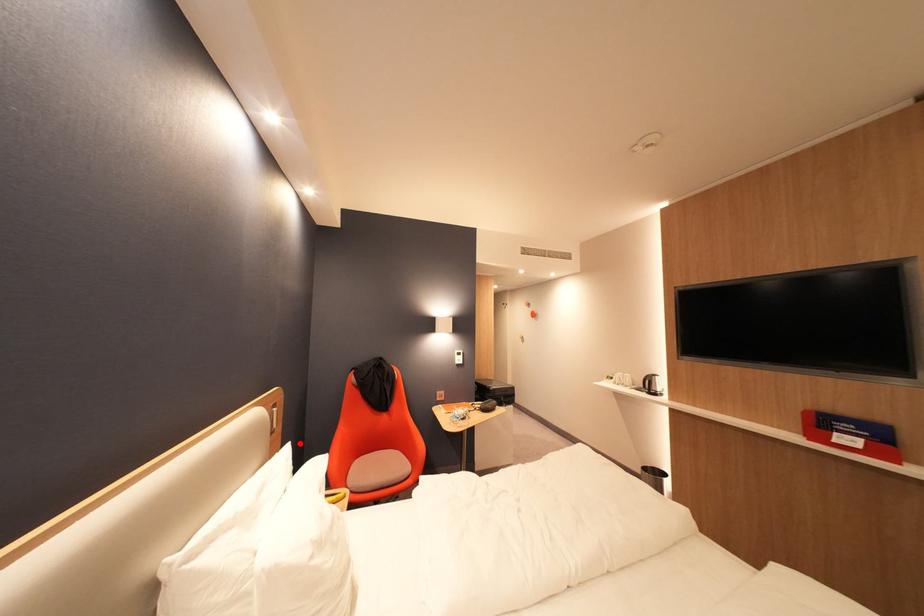
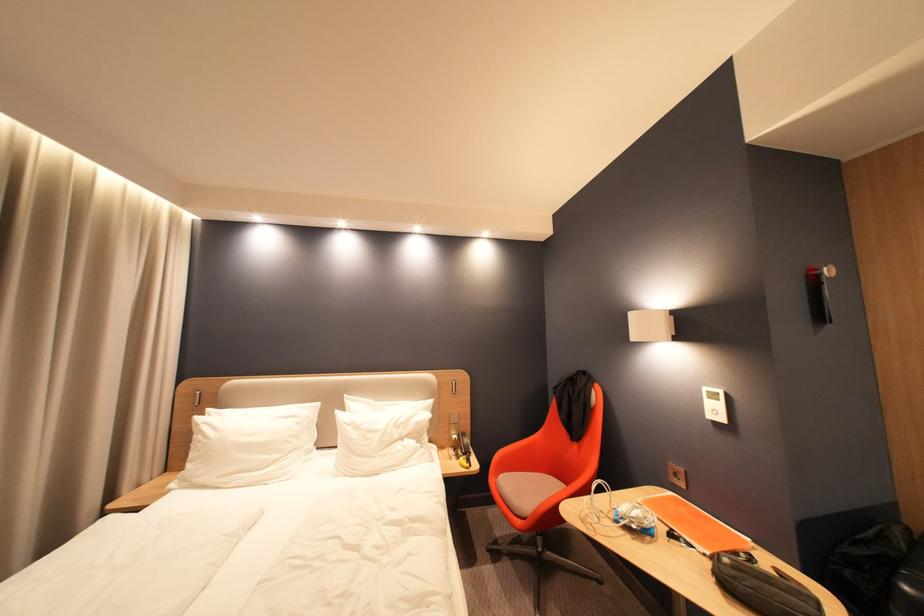
Question: I am providing you with two images of the same scene from different viewpoints. Given a red point in image1, look at the same physical point in image2. Is it:

Choices:
 (A) Closer to the viewpoint
 (B) Farther from the viewpoint

Answer: (B)